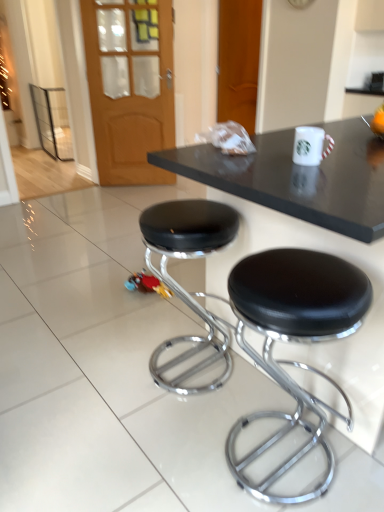
What do you see at coordinates (130, 86) in the screenshot? I see `wooden door at upper left` at bounding box center [130, 86].

What is the approximate width of wooden door at upper center?

wooden door at upper center is 4.26 inches wide.

Locate an element on the screen. black glossy table at center is located at coordinates (308, 324).

The height and width of the screenshot is (512, 384). Describe the element at coordinates (293, 340) in the screenshot. I see `black leather stool at lower right, positioned as the second stool in left-to-right order` at that location.

Locate an element on the screen. The height and width of the screenshot is (512, 384). wooden door at upper left is located at coordinates (130, 86).

Is wooden door at upper center surrounded by black glossy table at center?

That's incorrect, wooden door at upper center is not inside black glossy table at center.

From the image's perspective, which is below, black glossy table at center or wooden door at upper center?

black glossy table at center is shown below in the image.

From a real-world perspective, which object rests below the other?

black glossy table at center, from a real-world perspective.

Does point (348, 311) come closer to viewer compared to point (244, 25)?

That is True.

From the image's perspective, between wooden door at upper center and wooden door at upper left, who is located below?

From the image's view, wooden door at upper left is below.

Considering their positions, is wooden door at upper center located in front of or behind wooden door at upper left?

Clearly, wooden door at upper center is behind wooden door at upper left.

Looking at this image, how many degrees apart are the facing directions of wooden door at upper center and wooden door at upper left?

25.5 degrees separate the facing orientations of wooden door at upper center and wooden door at upper left.

Considering the sizes of objects wooden door at upper center and wooden door at upper left in the image provided, who is bigger, wooden door at upper center or wooden door at upper left?

wooden door at upper center.

Would you say wooden door at upper left is a long distance from black leather stool at lower right, the first stool from the right?

Yes, wooden door at upper left and black leather stool at lower right, the first stool from the right, are located far from each other.

Considering the positions of point (90, 39) and point (328, 339), is point (90, 39) closer or farther from the camera than point (328, 339)?

Point (90, 39) is positioned farther from the camera compared to point (328, 339).

This screenshot has width=384, height=512. I want to click on the 2nd stool in front of the wooden door at upper left, counting from the anchor's position, so click(x=293, y=340).

Looking at this image, considering the sizes of objects wooden door at upper left and black leather stool at lower right, the first stool from the right, in the image provided, who is wider, wooden door at upper left or black leather stool at lower right, the first stool from the right,?

Wider between the two is black leather stool at lower right, the first stool from the right.

Between wooden door at upper left and black glossy table at center, which one appears on the right side from the viewer's perspective?

From the viewer's perspective, black glossy table at center appears more on the right side.

Does wooden door at upper left have a lesser width compared to black glossy table at center?

Correct, the width of wooden door at upper left is less than that of black glossy table at center.

Is wooden door at upper left further to the viewer compared to black glossy table at center?

Yes, the depth of wooden door at upper left is greater than that of black glossy table at center.

Is black leather stool at lower right, positioned as the second stool in left-to-right order, aimed at wooden door at upper left?

No, black leather stool at lower right, positioned as the second stool in left-to-right order, is not facing towards wooden door at upper left.

Is black leather stool at lower right, the first stool from the right, not near wooden door at upper left?

Indeed, black leather stool at lower right, the first stool from the right, is not near wooden door at upper left.

Which of these two, black leather stool at lower right, the first stool from the right, or wooden door at upper left, is wider?

With larger width is black leather stool at lower right, the first stool from the right.

Does point (270, 329) appear closer or farther from the camera than point (140, 169)?

Clearly, point (270, 329) is closer to the camera than point (140, 169).

Are black leather stool at center, which ranks as the 1th stool in left-to-right order, and black leather stool at lower right, positioned as the second stool in left-to-right order, far apart?

That's not correct — black leather stool at center, which ranks as the 1th stool in left-to-right order, is a little close to black leather stool at lower right, positioned as the second stool in left-to-right order.

Does black leather stool at center, which ranks as the 1th stool in left-to-right order, turn towards black leather stool at lower right, positioned as the second stool in left-to-right order?

No, black leather stool at center, which ranks as the 1th stool in left-to-right order, does not turn towards black leather stool at lower right, positioned as the second stool in left-to-right order.

Considering the relative sizes of black leather stool at center, which ranks as the 1th stool in left-to-right order, and black leather stool at lower right, positioned as the second stool in left-to-right order, in the image provided, is black leather stool at center, which ranks as the 1th stool in left-to-right order, shorter than black leather stool at lower right, positioned as the second stool in left-to-right order,?

In fact, black leather stool at center, which ranks as the 1th stool in left-to-right order, may be taller than black leather stool at lower right, positioned as the second stool in left-to-right order.

Considering the relative sizes of black leather stool at center, which ranks as the 1th stool in left-to-right order, and black leather stool at lower right, positioned as the second stool in left-to-right order, in the image provided, is black leather stool at center, which ranks as the 1th stool in left-to-right order, smaller than black leather stool at lower right, positioned as the second stool in left-to-right order,?

No, black leather stool at center, which ranks as the 1th stool in left-to-right order, is not smaller than black leather stool at lower right, positioned as the second stool in left-to-right order.

Is point (252, 172) closer to viewer compared to point (297, 415)?

Yes.

Can you tell me how much black glossy table at center and black leather stool at lower right, positioned as the second stool in left-to-right order, differ in facing direction?

The angular difference between black glossy table at center and black leather stool at lower right, positioned as the second stool in left-to-right order, is 0.438 degrees.

From a real-world perspective, does black glossy table at center sit lower than black leather stool at lower right, positioned as the second stool in left-to-right order?

No, from a real-world perspective, black glossy table at center is not under black leather stool at lower right, positioned as the second stool in left-to-right order.

Is black glossy table at center turned away from black leather stool at lower right, positioned as the second stool in left-to-right order?

Yes, black glossy table at center's orientation is away from black leather stool at lower right, positioned as the second stool in left-to-right order.

Find the location of a particular element. The height and width of the screenshot is (512, 384). door above the black glossy table at center (from a real-world perspective) is located at coordinates (238, 61).

This screenshot has width=384, height=512. In order to click on glass door on the left of wooden door at upper center in this screenshot , I will do `click(130, 86)`.

Based on their spatial positions, is wooden door at upper left or black leather stool at center, which ranks as the 1th stool in left-to-right order, further from black glossy table at center?

wooden door at upper left is positioned further to the anchor black glossy table at center.

From the image, which object appears to be farther from wooden door at upper center, black leather stool at center, which ranks as the 1th stool in left-to-right order, or black leather stool at lower right, positioned as the second stool in left-to-right order?

black leather stool at lower right, positioned as the second stool in left-to-right order, lies further to wooden door at upper center than the other object.

Which object lies further to the anchor point black leather stool at lower right, positioned as the second stool in left-to-right order, black leather stool at center, the second stool from the right, or black glossy table at center?

black leather stool at center, the second stool from the right, is positioned further to the anchor black leather stool at lower right, positioned as the second stool in left-to-right order.

From the image, which object appears to be farther from wooden door at upper left, wooden door at upper center or black glossy table at center?

black glossy table at center.

Estimate the real-world distances between objects in this image. Which object is closer to black glossy table at center, wooden door at upper center or black leather stool at center, the second stool from the right?

Among the two, black leather stool at center, the second stool from the right, is located nearer to black glossy table at center.

Looking at the image, which one is located further to wooden door at upper center, black leather stool at lower right, positioned as the second stool in left-to-right order, or black glossy table at center?

black leather stool at lower right, positioned as the second stool in left-to-right order, is positioned further to the anchor wooden door at upper center.

Which object lies further to the anchor point wooden door at upper center, wooden door at upper left or black leather stool at center, which ranks as the 1th stool in left-to-right order?

Based on the image, black leather stool at center, which ranks as the 1th stool in left-to-right order, appears to be further to wooden door at upper center.

Which object lies nearer to the anchor point black leather stool at center, the second stool from the right, black leather stool at lower right, the first stool from the right, or wooden door at upper center?

black leather stool at lower right, the first stool from the right, is closer to black leather stool at center, the second stool from the right.

Locate an element on the screen. The image size is (384, 512). glass door between black leather stool at lower right, the first stool from the right, and wooden door at upper center from front to back is located at coordinates (130, 86).

Locate an element on the screen. This screenshot has height=512, width=384. glass door between black glossy table at center and wooden door at upper center from front to back is located at coordinates (130, 86).

This screenshot has width=384, height=512. In order to click on glass door between black leather stool at center, which ranks as the 1th stool in left-to-right order, and wooden door at upper center, along the z-axis in this screenshot , I will do `click(130, 86)`.

Locate an element on the screen. stool positioned between black leather stool at lower right, positioned as the second stool in left-to-right order, and wooden door at upper center from near to far is located at coordinates (181, 286).